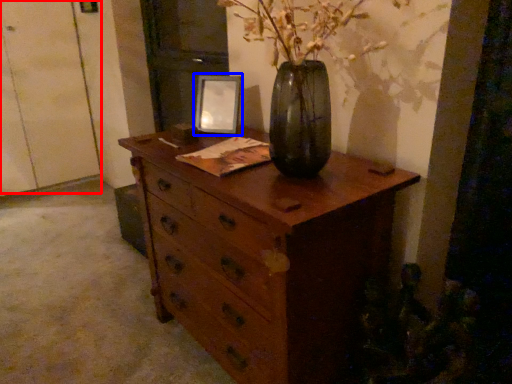
Question: Which point is further to the camera, door (highlighted by a red box) or picture frame (highlighted by a blue box)?

Choices:
 (A) door
 (B) picture frame

Answer: (A)